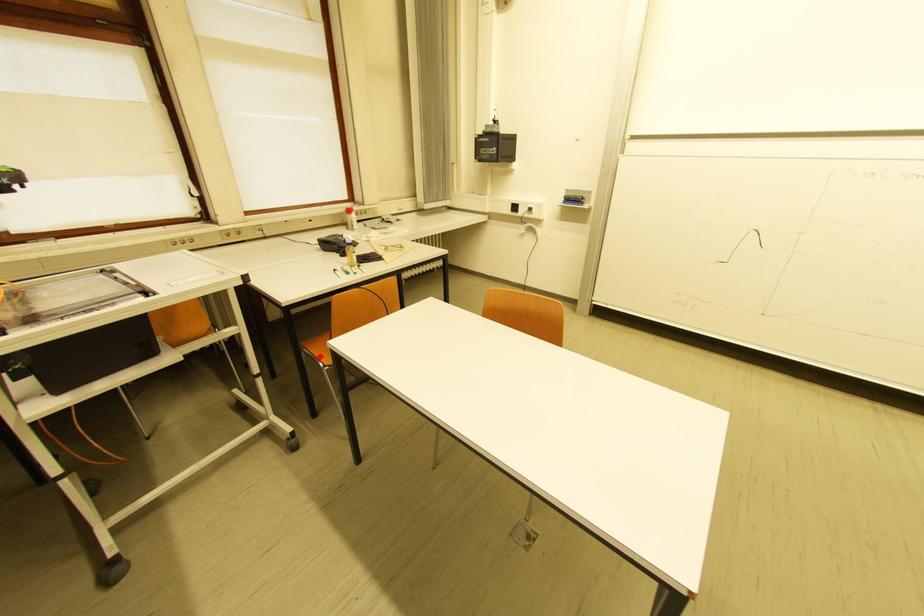
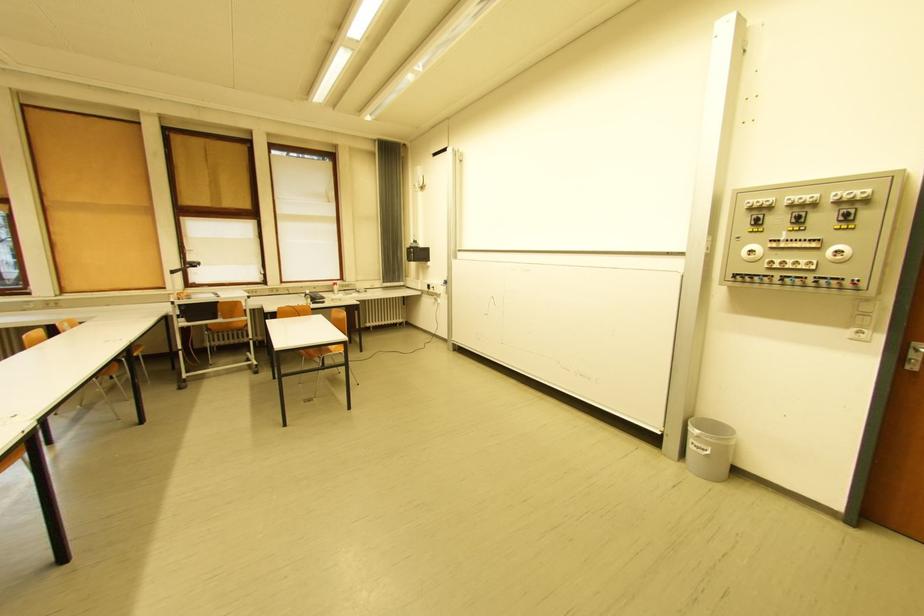
Question: I am providing you with two images of the same scene from different viewpoints. A red point is marked on the first image. Is the red point's position out of view in image 2?

Choices:
 (A) Yes
 (B) No

Answer: (A)